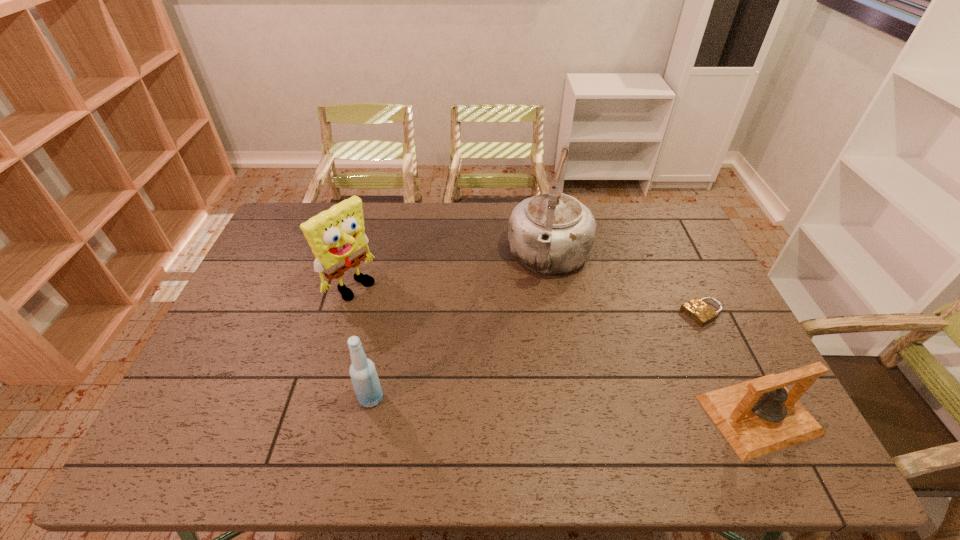
Locate an element on the screen. The height and width of the screenshot is (540, 960). object that stands as the second closest to the padlock is located at coordinates (552, 233).

Identify which object is the second closest to the third tallest object. Please provide its 2D coordinates. Your answer should be formatted as a tuple, i.e. [(x, y)], where the tuple contains the x and y coordinates of a point satisfying the conditions above.

[(552, 233)]

Identify the location of vacant region that satisfies the following two spatial constraints: 1. on the front side of the fourth tallest object; 2. on the right side of the third object from right to left. (576, 415).

Find the location of a particular element. The height and width of the screenshot is (540, 960). vacant position in the image that satisfies the following two spatial constraints: 1. on the back side of the tallest object; 2. on the left side of the bottle is located at coordinates (399, 258).

The width and height of the screenshot is (960, 540). Find the location of `free spot that satisfies the following two spatial constraints: 1. on the front side of the sponge; 2. on the right side of the bell`. free spot that satisfies the following two spatial constraints: 1. on the front side of the sponge; 2. on the right side of the bell is located at coordinates (314, 415).